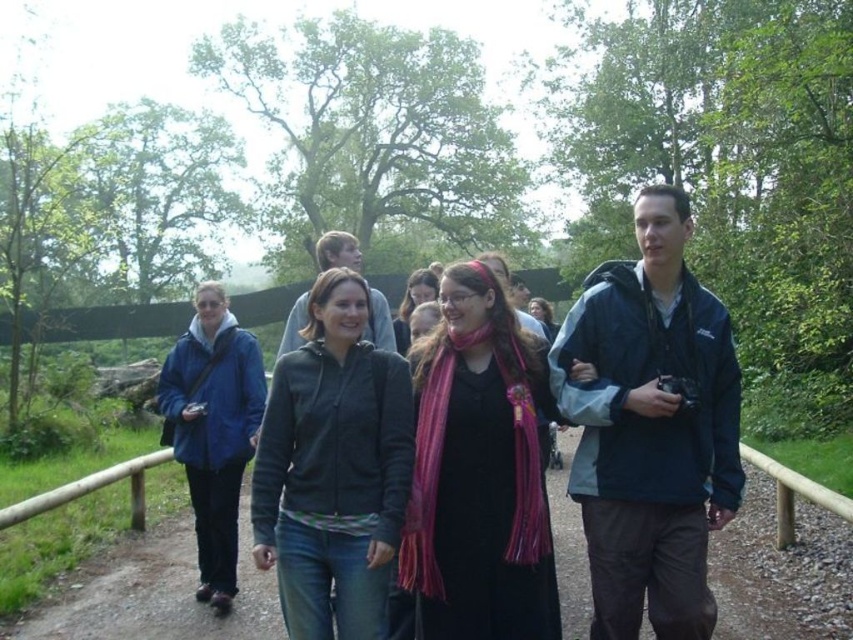
Can you confirm if dark gray zip-up jacket at center is bigger than blue matte jacket at left?

No.

Describe the element at coordinates (334, 468) in the screenshot. I see `dark gray zip-up jacket at center` at that location.

Is point (410, 461) positioned behind point (184, 353)?

No, (410, 461) is closer to viewer.

The height and width of the screenshot is (640, 853). Find the location of `dark gray zip-up jacket at center`. dark gray zip-up jacket at center is located at coordinates (334, 468).

Who is more distant from viewer, (633,634) or (425,577)?

The point (633,634) is behind.

Between blue fabric jacket at center and pink striped scarf at center, which one is positioned higher?

blue fabric jacket at center

Who is more forward, (x=602, y=618) or (x=502, y=592)?

Point (x=602, y=618)

The height and width of the screenshot is (640, 853). What are the coordinates of `blue fabric jacket at center` in the screenshot? It's located at 651,428.

Between pink striped scarf at center and matte black jacket at center, which one appears on the right side from the viewer's perspective?

pink striped scarf at center is more to the right.

Between pink striped scarf at center and matte black jacket at center, which one has less height?

With less height is pink striped scarf at center.

This screenshot has height=640, width=853. I want to click on pink striped scarf at center, so click(x=476, y=477).